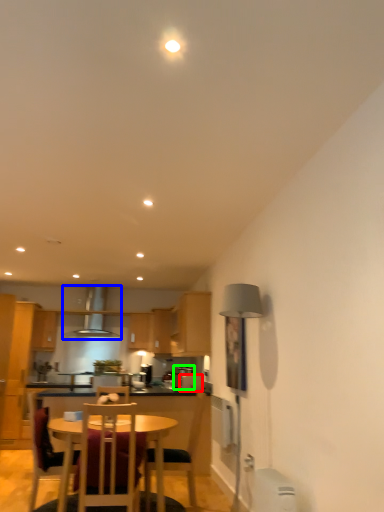
Question: Considering the real-world distances, which object is farthest from appliance (highlighted by a red box)? exhaust hood (highlighted by a blue box) or appliance (highlighted by a green box)?

Choices:
 (A) exhaust hood
 (B) appliance

Answer: (A)